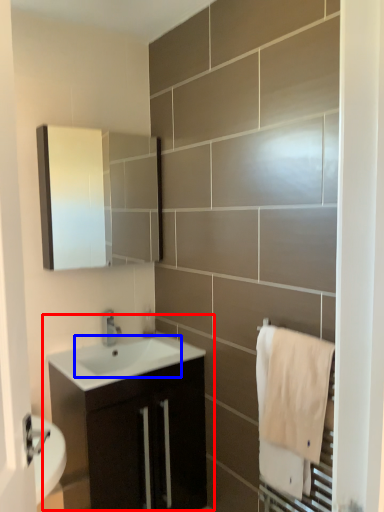
Question: Which object is further to the camera taking this photo, bathroom cabinet (highlighted by a red box) or sink (highlighted by a blue box)?

Choices:
 (A) bathroom cabinet
 (B) sink

Answer: (B)